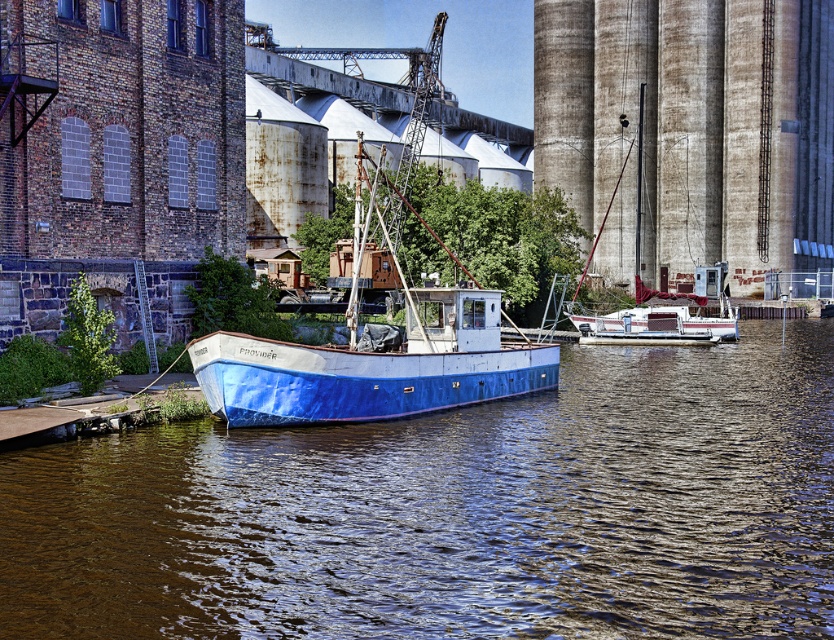
Who is higher up, brown water at center or white-painted wood sailboat at center-right?

Positioned higher is white-painted wood sailboat at center-right.

Can you confirm if brown water at center is bigger than white-painted wood sailboat at center-right?

Incorrect, brown water at center is not larger than white-painted wood sailboat at center-right.

Is point (697, 525) less distant than point (609, 314)?

Yes, point (697, 525) is in front of point (609, 314).

At what (x,y) coordinates should I click in order to perform the action: click on brown water at center. Please return your answer as a coordinate pair (x, y). Image resolution: width=834 pixels, height=640 pixels. Looking at the image, I should click on 455,513.

Between blue matte boat at center and white-painted wood sailboat at center-right, which one appears on the right side from the viewer's perspective?

white-painted wood sailboat at center-right is more to the right.

Can you confirm if blue matte boat at center is bigger than white-painted wood sailboat at center-right?

No, blue matte boat at center is not bigger than white-painted wood sailboat at center-right.

Identify the location of blue matte boat at center. The height and width of the screenshot is (640, 834). (374, 368).

Does brown water at center have a greater height compared to blue matte boat at center?

Incorrect, brown water at center's height is not larger of blue matte boat at center's.

Between brown water at center and blue matte boat at center, which one has less height?

Standing shorter between the two is brown water at center.

Who is more distant from viewer, [674,632] or [329,362]?

The point [329,362] is more distant.

I want to click on brown water at center, so click(455, 513).